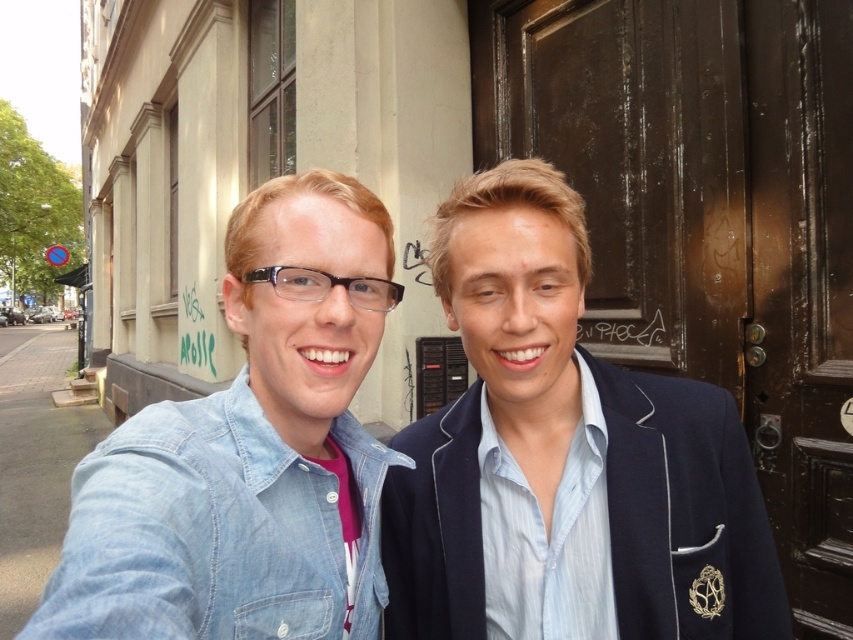
Question: Does denim jacket at center have a larger size compared to denim jacket at lower left?

Choices:
 (A) yes
 (B) no

Answer: (A)

Question: In this image, where is denim jacket at center located relative to denim jacket at lower left?

Choices:
 (A) below
 (B) above

Answer: (B)

Question: Is denim jacket at center further to camera compared to denim jacket at lower left?

Choices:
 (A) yes
 (B) no

Answer: (A)

Question: Among these objects, which one is farthest from the camera?

Choices:
 (A) denim jacket at lower left
 (B) denim jacket at center

Answer: (B)

Question: Among these objects, which one is nearest to the camera?

Choices:
 (A) denim jacket at lower left
 (B) denim jacket at center

Answer: (A)